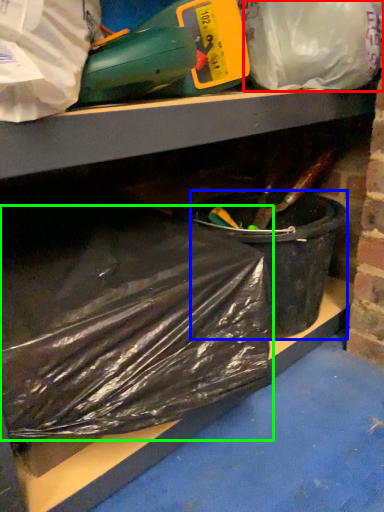
Question: Estimate the real-world distances between objects in this image. Which object is farther from plastic bag (highlighted by a red box), recycling bin (highlighted by a blue box) or plastic bag (highlighted by a green box)?

Choices:
 (A) recycling bin
 (B) plastic bag

Answer: (B)